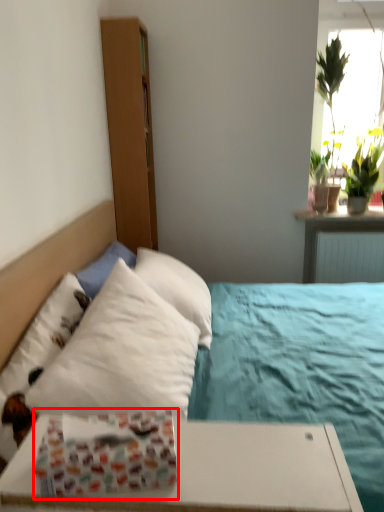
Question: From the image's perspective, where is gift wrap (annotated by the red box) located in relation to bed in the image?

Choices:
 (A) above
 (B) below

Answer: (B)